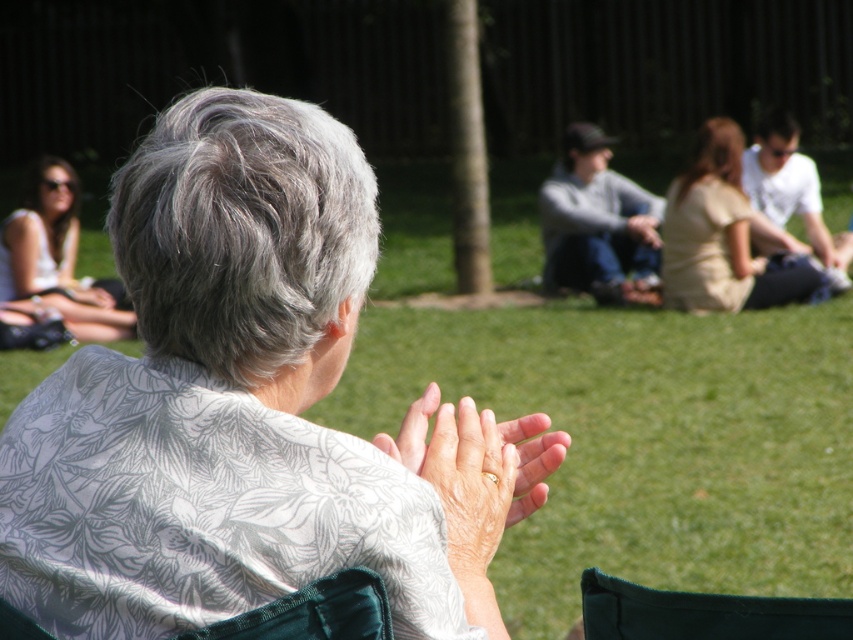
Is gray cotton sweater at center to the right of matte white shirt at upper left from the viewer's perspective?

Correct, you'll find gray cotton sweater at center to the right of matte white shirt at upper left.

I want to click on gray cotton sweater at center, so click(x=598, y=224).

Who is more distant from viewer, (612, 216) or (105, 337)?

The point (612, 216) is behind.

Identify the location of gray cotton sweater at center. This screenshot has width=853, height=640. (598, 224).

Between beige fabric dress at center and gray cotton sweater at center, which one appears on the left side from the viewer's perspective?

Positioned to the left is gray cotton sweater at center.

Is beige fabric dress at center taller than gray cotton sweater at center?

No.

Identify the location of beige fabric dress at center. (718, 236).

Image resolution: width=853 pixels, height=640 pixels. Describe the element at coordinates (718, 236) in the screenshot. I see `beige fabric dress at center` at that location.

Between point (749, 244) and point (9, 266), which one is positioned in front?

Point (9, 266) is in front.

You are a GUI agent. You are given a task and a screenshot of the screen. Output one action in this format:
    pyautogui.click(x=<x>, y=<y>)
    Task: Click on the beige fabric dress at center
    The image size is (853, 640).
    Given the screenshot: What is the action you would take?
    pyautogui.click(x=718, y=236)